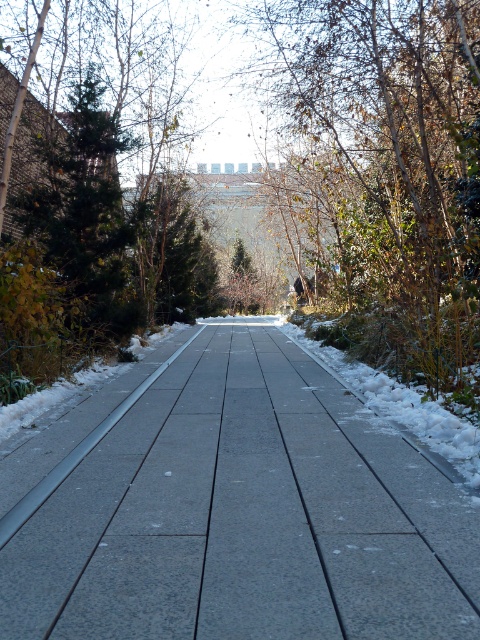
Can you confirm if gray concrete pavement at center is thinner than brown leafy tree at center?

Correct, gray concrete pavement at center's width is less than brown leafy tree at center's.

Can you confirm if gray concrete pavement at center is positioned below brown leafy tree at center?

Indeed, gray concrete pavement at center is positioned under brown leafy tree at center.

Based on the photo, who is more forward, (133, 513) or (377, 326)?

Point (133, 513) is more forward.

Where is `gray concrete pavement at center`? gray concrete pavement at center is located at coordinates (232, 509).